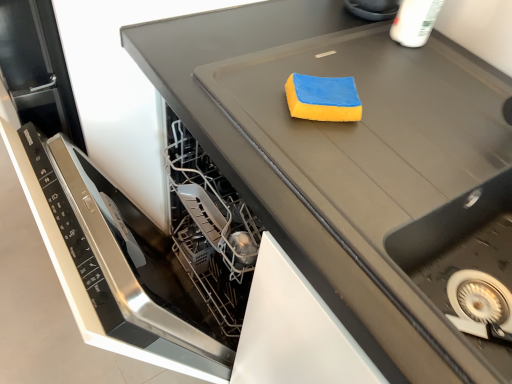
The image size is (512, 384). Identify the location of blue sponge at center. (323, 98).

The image size is (512, 384). What do you see at coordinates (323, 98) in the screenshot? I see `blue sponge at center` at bounding box center [323, 98].

Locate an element on the screen. This screenshot has height=384, width=512. blue sponge at center is located at coordinates (323, 98).